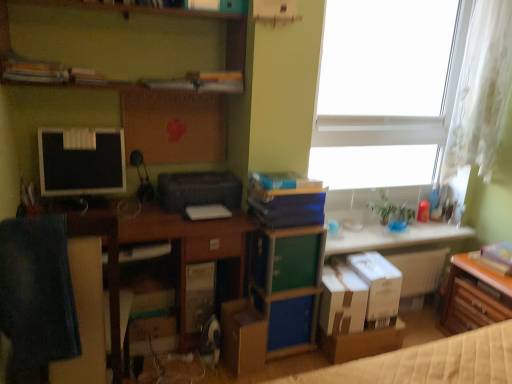
Find the location of a particular element. free space above white matte book at center, which ranks as the 1th book in bottom-to-top order (from a real-world perspective) is located at coordinates (209, 207).